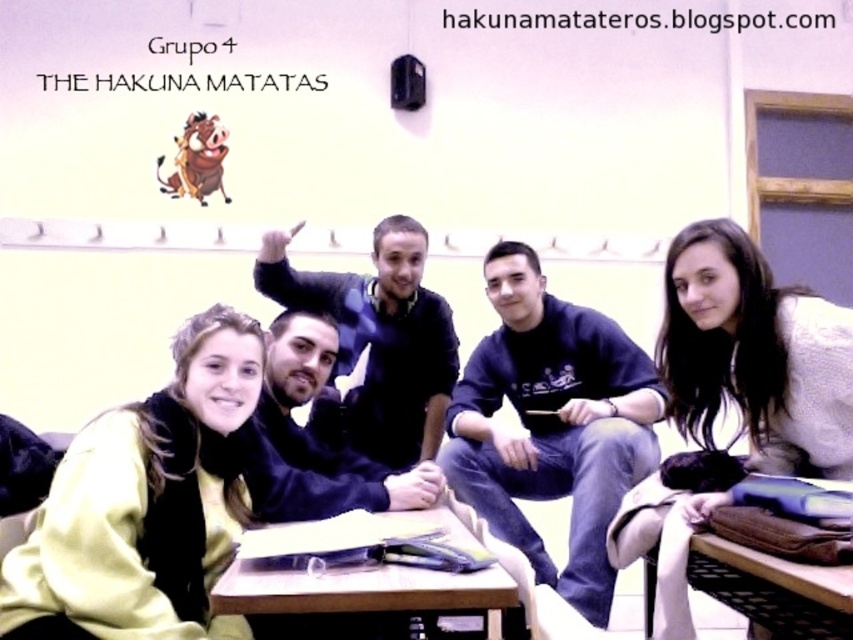
Is black matte jacket at center thinner than wooden table at center?

Yes, black matte jacket at center is thinner than wooden table at center.

Is point (341, 500) positioned behind point (380, 588)?

That is True.

Find the location of a particular element. The width and height of the screenshot is (853, 640). black matte jacket at center is located at coordinates (316, 435).

From the picture: Does black matte shirt at center have a larger size compared to black matte jacket at center?

Indeed, black matte shirt at center has a larger size compared to black matte jacket at center.

Between point (397, 371) and point (322, 460), which one is positioned behind?

Positioned behind is point (397, 371).

Identify the location of black matte shirt at center. The image size is (853, 640). pos(379,339).

Does point (376, 380) come closer to viewer compared to point (491, 540)?

That is False.

Between black matte shirt at center and wooden table at center, which one appears on the left side from the viewer's perspective?

From the viewer's perspective, black matte shirt at center appears more on the left side.

Image resolution: width=853 pixels, height=640 pixels. Describe the element at coordinates (379, 339) in the screenshot. I see `black matte shirt at center` at that location.

The height and width of the screenshot is (640, 853). What are the coordinates of `black matte shirt at center` in the screenshot? It's located at (379, 339).